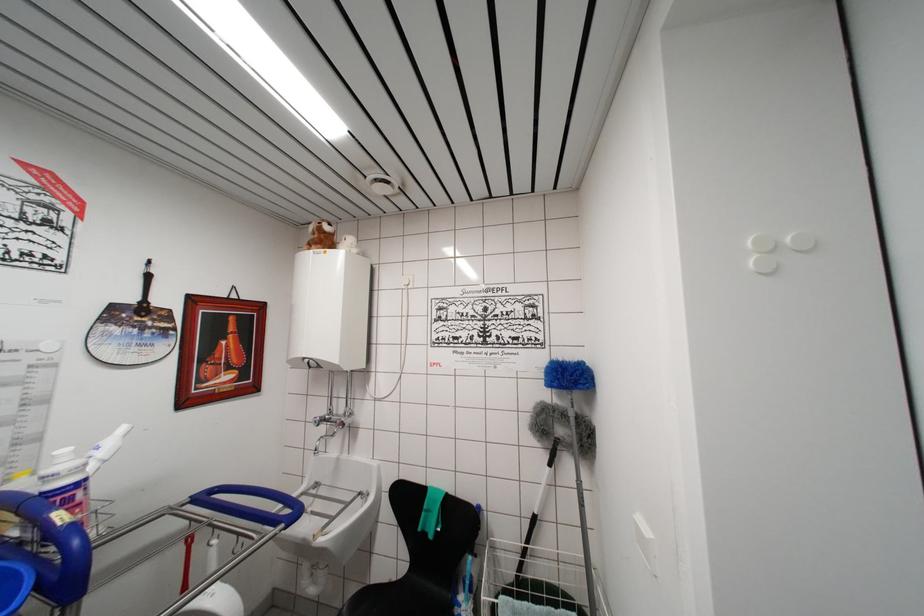
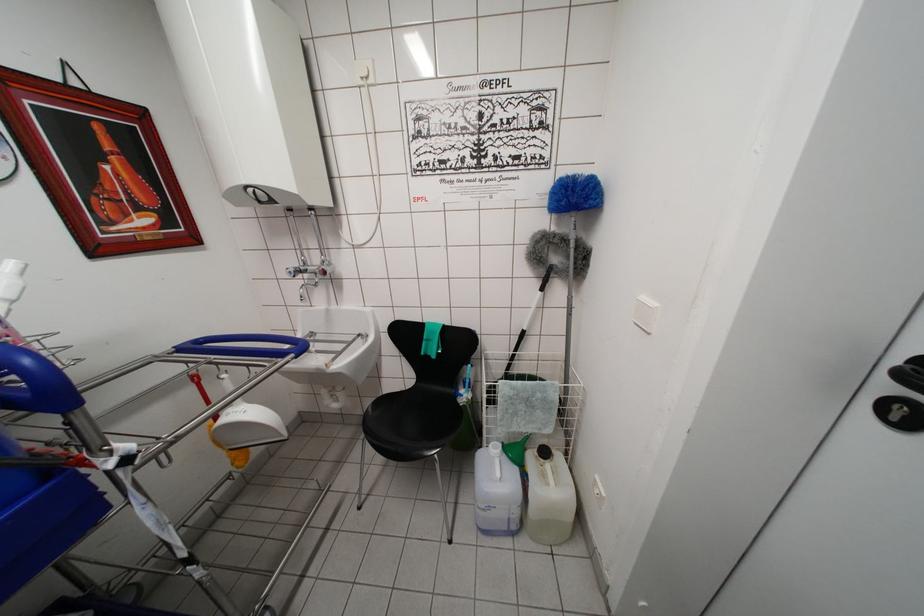
Where in the second image is the point corresponding to point 650,537 from the first image?

(657, 308)